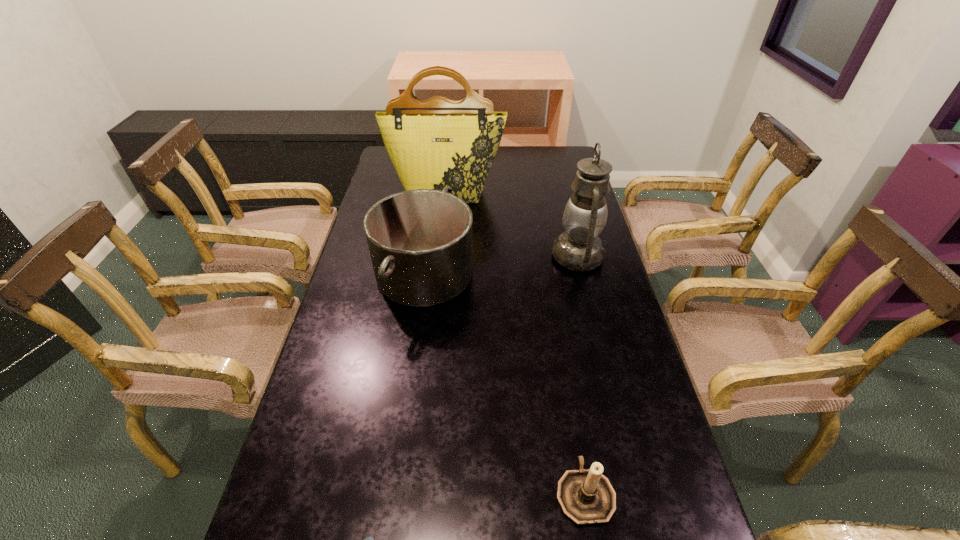
At what (x,y) coordinates should I click in order to perform the action: click on vacant point located between the tallest object and the fourth shortest object. Please return your answer as a coordinate pair (x, y). Looking at the image, I should click on (513, 224).

Where is `empty space between the tallest object and the second nearest object`? This screenshot has height=540, width=960. empty space between the tallest object and the second nearest object is located at coordinates (516, 342).

Locate an element on the screen. free space between the farthest object and the oil lamp is located at coordinates (513, 224).

This screenshot has height=540, width=960. Find the location of `vacant area that lies between the third shortest object and the candle holder`. vacant area that lies between the third shortest object and the candle holder is located at coordinates (505, 383).

Select which object appears as the second closest to the pan. Please provide its 2D coordinates. Your answer should be formatted as a tuple, i.e. [(x, y)], where the tuple contains the x and y coordinates of a point satisfying the conditions above.

[(579, 248)]

Select which object appears as the closest to the candle holder. Please provide its 2D coordinates. Your answer should be formatted as a tuple, i.e. [(x, y)], where the tuple contains the x and y coordinates of a point satisfying the conditions above.

[(370, 539)]

Locate an element on the screen. This screenshot has width=960, height=540. free point that satisfies the following two spatial constraints: 1. on the back side of the second nearest object; 2. on the right side of the fourth shortest object is located at coordinates (545, 256).

Where is `free region that satisfies the following two spatial constraints: 1. on the front-facing side of the farthest object; 2. on the left side of the second tallest object`? This screenshot has width=960, height=540. free region that satisfies the following two spatial constraints: 1. on the front-facing side of the farthest object; 2. on the left side of the second tallest object is located at coordinates (440, 256).